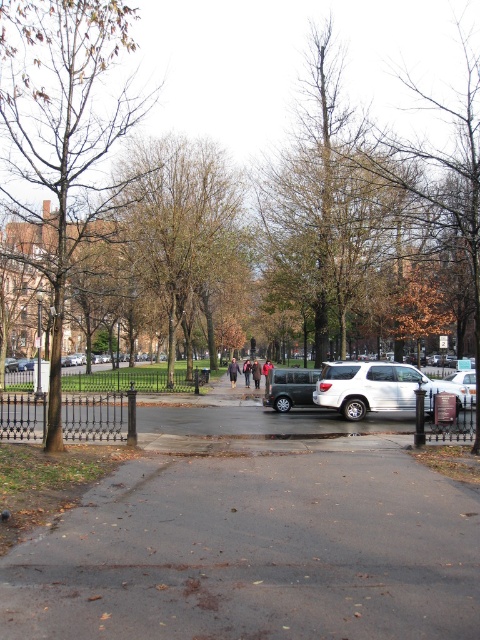
Does dark gray jacket at center have a lesser width compared to dark blue jacket at center?

In fact, dark gray jacket at center might be wider than dark blue jacket at center.

Who is more forward, (249, 380) or (229, 369)?

Point (229, 369) is in front.

Where is `dark gray jacket at center`? This screenshot has width=480, height=640. dark gray jacket at center is located at coordinates (253, 371).

Measure the distance between dark blue jeans at center and dark brown leather coat at center.

dark blue jeans at center and dark brown leather coat at center are 10.11 feet apart.

Describe the element at coordinates (247, 371) in the screenshot. This screenshot has width=480, height=640. I see `dark blue jeans at center` at that location.

Is point (248, 376) less distant than point (266, 358)?

That is True.

You are a GUI agent. You are given a task and a screenshot of the screen. Output one action in this format:
    pyautogui.click(x=<x>, y=<y>)
    Task: Click on the dark blue jeans at center
    
    Given the screenshot: What is the action you would take?
    pyautogui.click(x=247, y=371)

Can you confirm if dark blue jacket at center is positioned to the right of dark blue jeans at center?

In fact, dark blue jacket at center is to the left of dark blue jeans at center.

Is dark blue jacket at center wider than dark blue jeans at center?

Correct, the width of dark blue jacket at center exceeds that of dark blue jeans at center.

Does point (229, 374) come farther from viewer compared to point (245, 362)?

No, it is not.

Locate an element on the screen. The image size is (480, 640). dark blue jacket at center is located at coordinates (232, 371).